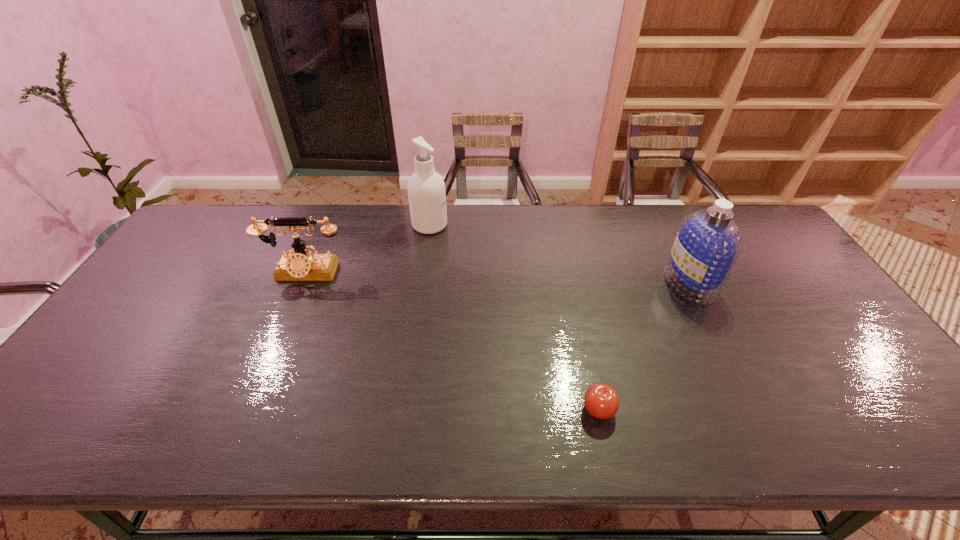
The height and width of the screenshot is (540, 960). I want to click on the farther cleansing agent, so click(x=426, y=190).

Where is `the left cleansing agent`? This screenshot has width=960, height=540. the left cleansing agent is located at coordinates (426, 190).

Image resolution: width=960 pixels, height=540 pixels. What are the coordinates of `the nearer cleansing agent` in the screenshot? It's located at (708, 243).

Image resolution: width=960 pixels, height=540 pixels. In order to click on the rightmost object in this screenshot , I will do `click(708, 243)`.

You are a GUI agent. You are given a task and a screenshot of the screen. Output one action in this format:
    pyautogui.click(x=<x>, y=<y>)
    Task: Click on the leftmost object
    The width and height of the screenshot is (960, 540).
    Given the screenshot: What is the action you would take?
    pyautogui.click(x=303, y=265)

Where is `telephone`? This screenshot has width=960, height=540. telephone is located at coordinates (303, 265).

Find the location of a particular element. Image resolution: width=960 pixels, height=540 pixels. the third object from left to right is located at coordinates [601, 400].

Locate an element on the screen. This screenshot has height=540, width=960. the nearest object is located at coordinates (601, 400).

At what (x,y) coordinates should I click in order to perform the action: click on vacant space positioned on the front label of the farther cleansing agent. Please return your answer as a coordinate pair (x, y). Looking at the image, I should click on (508, 225).

Where is `vacant space located 0.220m on the right of the right cleansing agent`? The height and width of the screenshot is (540, 960). vacant space located 0.220m on the right of the right cleansing agent is located at coordinates (787, 284).